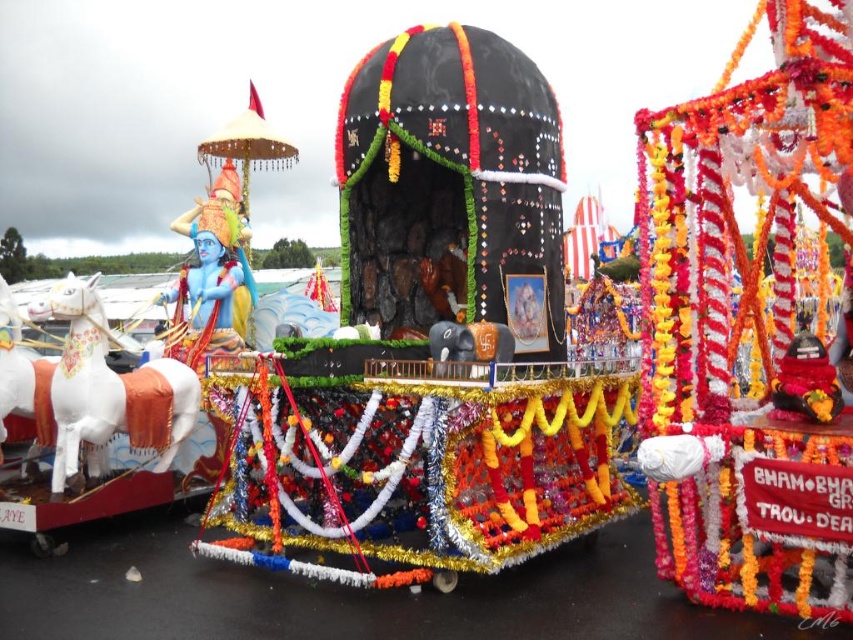
Can you confirm if white glossy horse at left is positioned above blue painted statue at left?

No.

Can you confirm if white glossy horse at left is thinner than blue painted statue at left?

No, white glossy horse at left is not thinner than blue painted statue at left.

Is point (119, 372) positioned before point (239, 221)?

Yes, point (119, 372) is in front of point (239, 221).

Locate an element on the screen. The image size is (853, 640). white glossy horse at left is located at coordinates (111, 388).

Does blue painted statue at left lie behind shiny red statue at center?

Yes.

Between blue painted statue at left and shiny red statue at center, which one appears on the right side from the viewer's perspective?

shiny red statue at center is more to the right.

Between point (206, 344) and point (801, 380), which one is positioned behind?

Point (206, 344)

This screenshot has width=853, height=640. What are the coordinates of `blue painted statue at left` in the screenshot? It's located at (213, 275).

Is white glossy horse at left positioned before shiny red statue at center?

No, white glossy horse at left is behind shiny red statue at center.

The height and width of the screenshot is (640, 853). Describe the element at coordinates (111, 388) in the screenshot. I see `white glossy horse at left` at that location.

I want to click on white glossy horse at left, so click(x=111, y=388).